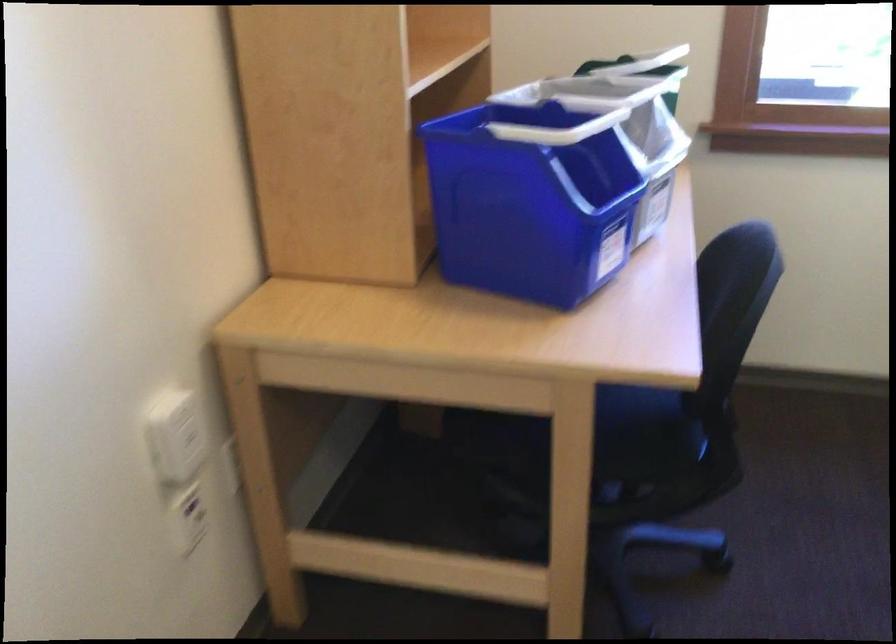
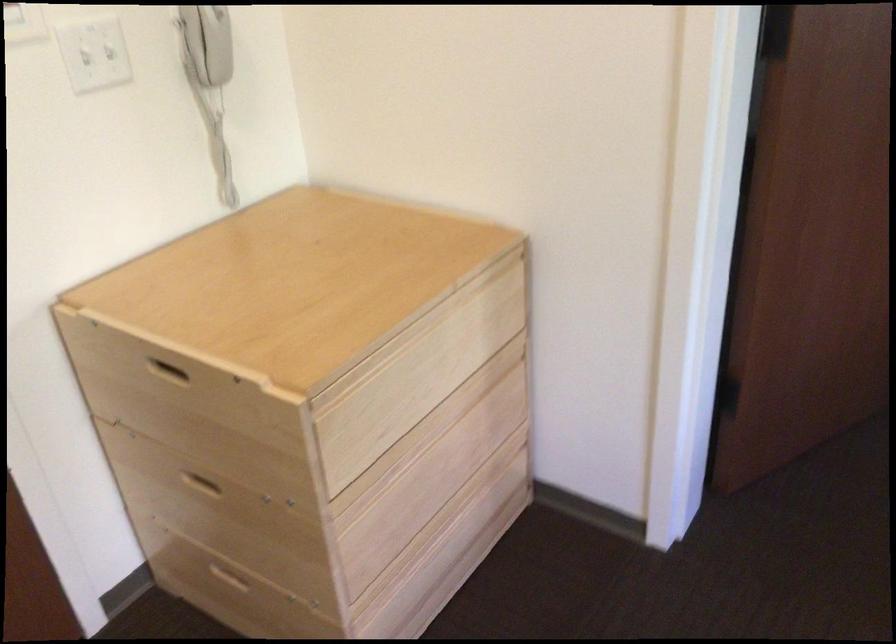
The images are taken continuously from a first-person perspective. In which direction is your viewpoint rotating?

The rotation direction of the camera is left-down.